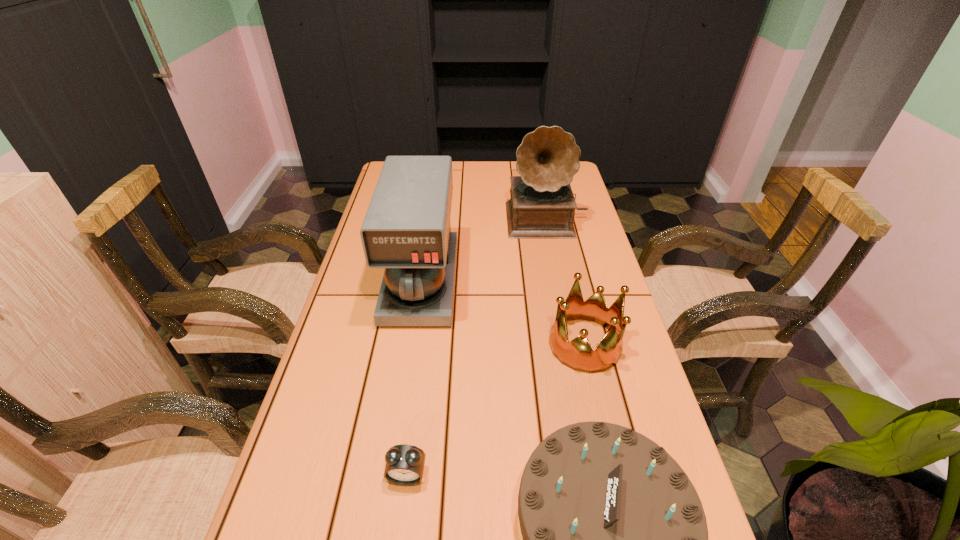
Find the location of a particular element. record player is located at coordinates (542, 206).

I want to click on coffee maker, so click(x=406, y=230).

Find the location of a particular element. This screenshot has width=960, height=540. crown is located at coordinates (578, 354).

This screenshot has height=540, width=960. Find the location of `the shortest object`. the shortest object is located at coordinates (404, 466).

This screenshot has height=540, width=960. I want to click on free space located from the horn of the record player, so click(x=558, y=273).

Find the location of a particular element. The height and width of the screenshot is (540, 960). vacant area located on the carafe side of the coffee maker is located at coordinates pyautogui.click(x=393, y=472).

Where is `free region located on the front of the crown`? This screenshot has height=540, width=960. free region located on the front of the crown is located at coordinates (599, 408).

The height and width of the screenshot is (540, 960). What are the coordinates of `object that is positioned at the left edge` in the screenshot? It's located at (406, 230).

The height and width of the screenshot is (540, 960). Identify the location of record player located at the right edge. (542, 206).

At what (x,y) coordinates should I click in order to perform the action: click on crown at the right edge. Please return your answer as a coordinate pair (x, y). Image resolution: width=960 pixels, height=540 pixels. Looking at the image, I should click on click(578, 354).